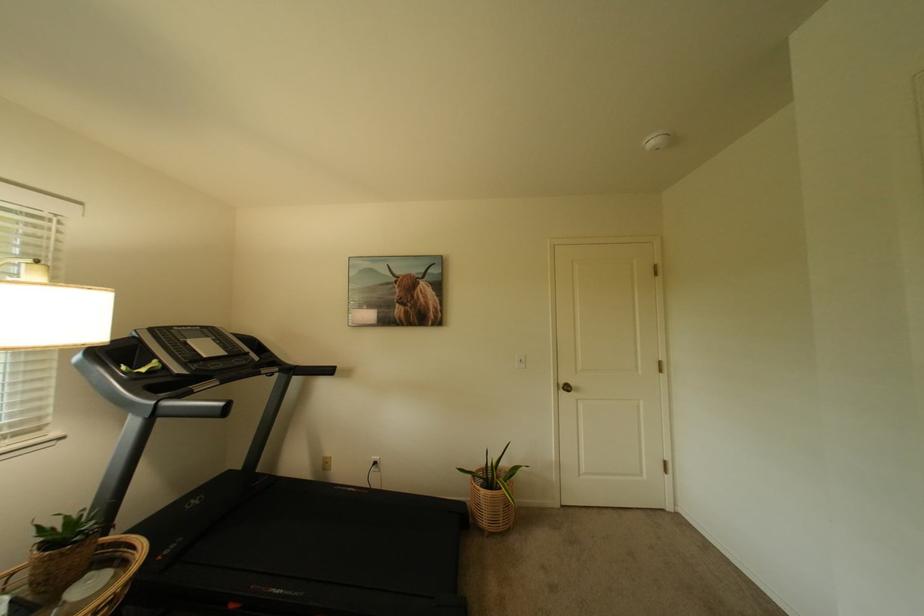
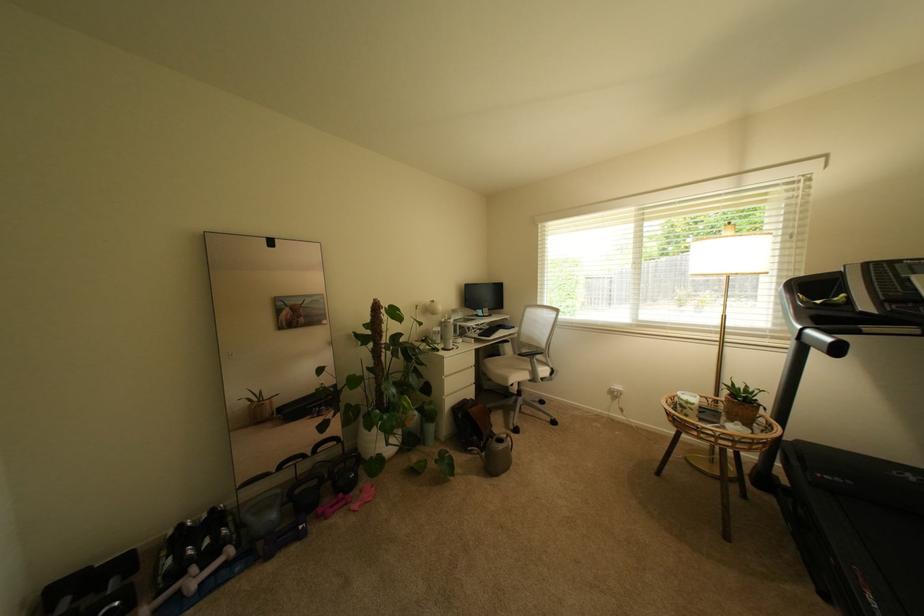
Locate, in the second image, the point that corresponds to [152,371] in the first image.

(827, 302)